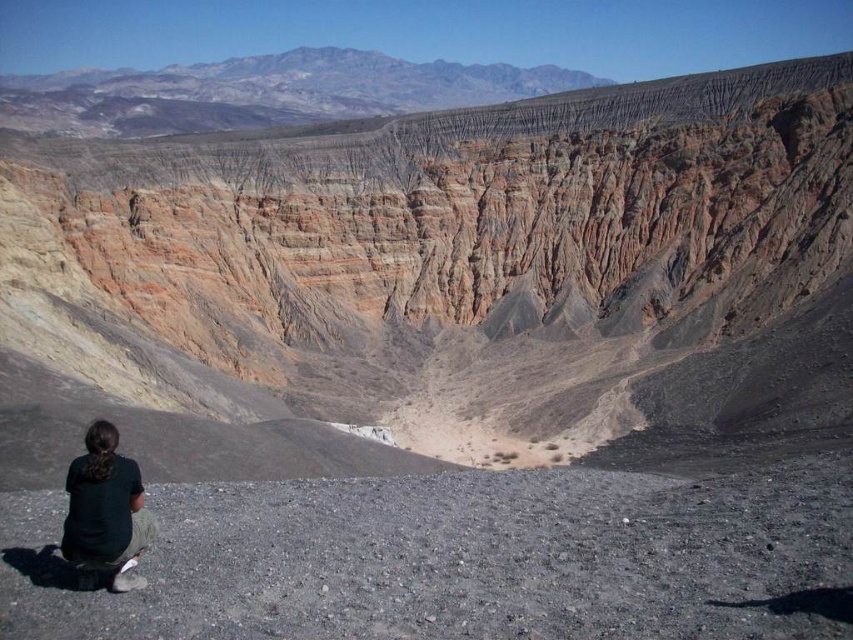
You are standing at the edge of the canyon where the person is sitting. You want to take a photo of the rugged rock mountain at upper center. Which direction should you face to capture it in your camera view?

The rugged rock mountain at upper center is located at point (263, 92), so you should face towards the upper center direction to capture it in your camera view.

You are a hiker planning to set up a campsite near the rugged rock mountain at upper center. The coordinates provided are point (263,92). Based on the image, is this point located on the rugged rock mountain at upper center?

Yes, the point (263,92) is on the rugged rock mountain at upper center, so it is suitable for setting up a campsite there.